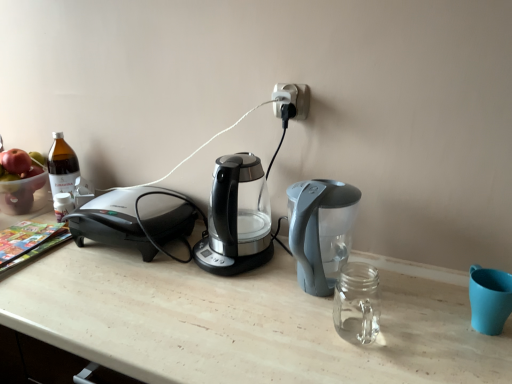
Question: Is translucent plastic bowl at left positioned before transparent glass coffee maker at center?

Choices:
 (A) yes
 (B) no

Answer: (B)

Question: Is translucent plastic bowl at left wider than transparent glass coffee maker at center?

Choices:
 (A) yes
 (B) no

Answer: (B)

Question: From the image's perspective, would you say translucent plastic bowl at left is shown under transparent glass coffee maker at center?

Choices:
 (A) no
 (B) yes

Answer: (A)

Question: From a real-world perspective, is translucent plastic bowl at left physically below transparent glass coffee maker at center?

Choices:
 (A) yes
 (B) no

Answer: (A)

Question: Is translucent plastic bowl at left at the right side of transparent glass coffee maker at center?

Choices:
 (A) yes
 (B) no

Answer: (B)

Question: From the image's perspective, is translucent plastic bowl at left on transparent glass coffee maker at center?

Choices:
 (A) yes
 (B) no

Answer: (A)

Question: Is translucent plastic bowl at left shorter than black plastic plug at upper center?

Choices:
 (A) yes
 (B) no

Answer: (B)

Question: Is black plastic plug at upper center at the back of translucent plastic bowl at left?

Choices:
 (A) no
 (B) yes

Answer: (A)

Question: From the image's perspective, does translucent plastic bowl at left appear lower than black plastic plug at upper center?

Choices:
 (A) yes
 (B) no

Answer: (A)

Question: Is translucent plastic bowl at left positioned behind black plastic plug at upper center?

Choices:
 (A) no
 (B) yes

Answer: (B)

Question: From a real-world perspective, is translucent plastic bowl at left positioned under black plastic plug at upper center based on gravity?

Choices:
 (A) yes
 (B) no

Answer: (A)

Question: Is translucent plastic bowl at left at the right side of black plastic plug at upper center?

Choices:
 (A) no
 (B) yes

Answer: (A)

Question: From the image's perspective, would you say transparent glass coffee maker at center is shown under translucent plastic bowl at left?

Choices:
 (A) yes
 (B) no

Answer: (A)